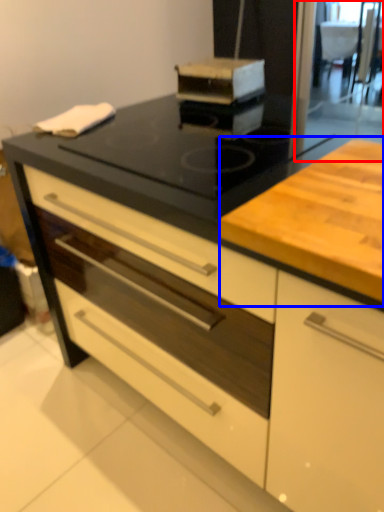
Question: Which point is closer to the camera, screen door (highlighted by a red box) or counter (highlighted by a blue box)?

Choices:
 (A) screen door
 (B) counter

Answer: (B)